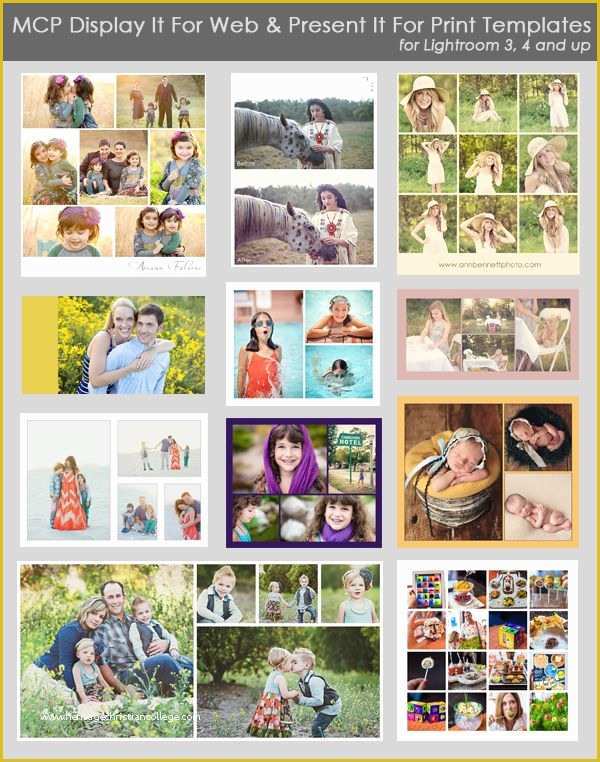
Where is `photo graphs in a 2x3x2 grid collage`? The height and width of the screenshot is (762, 600). photo graphs in a 2x3x2 grid collage is located at coordinates (60, 97), (169, 104), (124, 165), (62, 168), (165, 165), (152, 235), (78, 238).